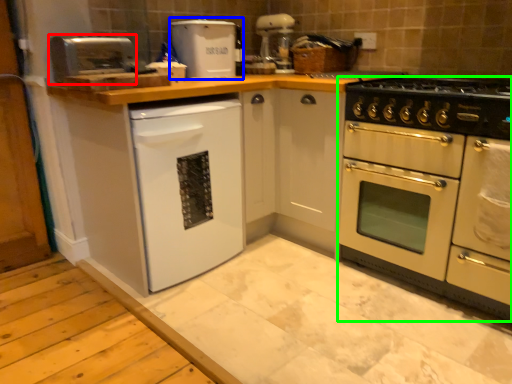
Question: Which is farther away from appliance (highlighted by a red box)? appliance (highlighted by a blue box) or oven (highlighted by a green box)?

Choices:
 (A) appliance
 (B) oven

Answer: (B)